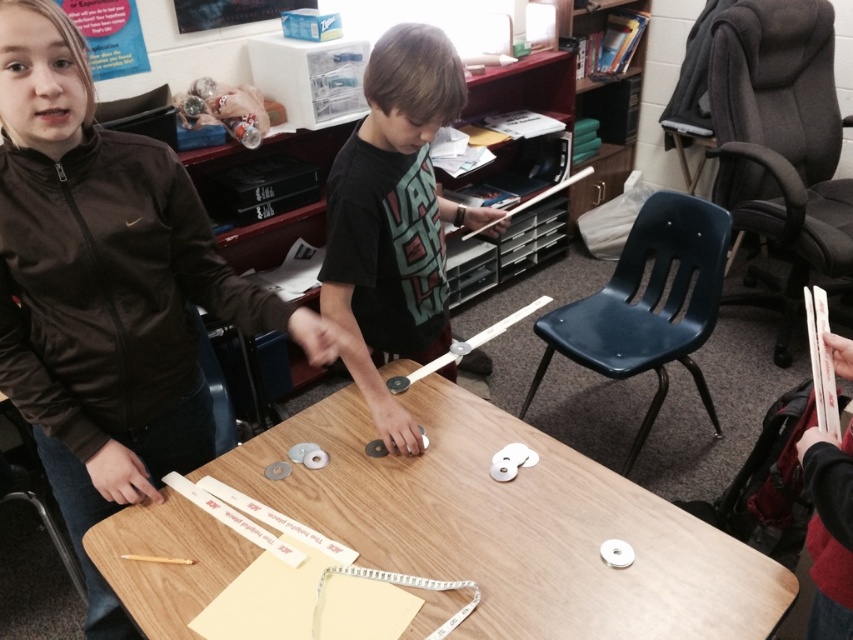
You are a teacher observing the classroom scene. You need to determine the spatial relationship between the two children based on their clothing. Which child is positioned higher up in the image, the one wearing the brown matte jacket at upper left or the black matte shirt at center?

The brown matte jacket at upper left is located below the black matte shirt at center, meaning the child in the black matte shirt at center is positioned higher up in the image.

You are a student in the classroom looking at the table where the two children are working. There are two points marked on the table surface. The first point is at coordinate point (x=129, y=170) and the second is at coordinate point (x=744, y=118). From your perspective, which point appears closer to you?

Point (x=129, y=170) is closer to the camera than point (x=744, y=118), so the first point appears closer to you.